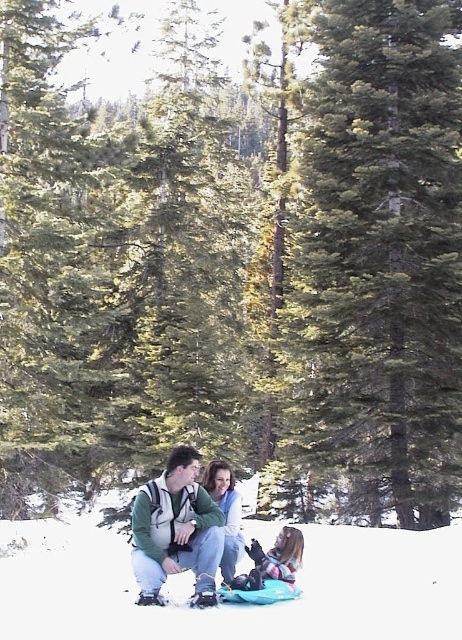
You are standing in the winter forest scene and want to place a small pinecone exactly at the point marked as point (232, 605). What will the pinecone be placed on?

The pinecone will be placed on the white fluffy snow at lower center located at point (232, 605).

You are standing in the winter forest scene and want to take a photo. There are two points marked in the image, point A at coordinates point (145, 536) and point B at coordinates point (299, 563). Which point is closer to your current position?

Point A at coordinates point (145, 536) is closer to your current position because it is closer to the camera than point B at coordinates point (299, 563).